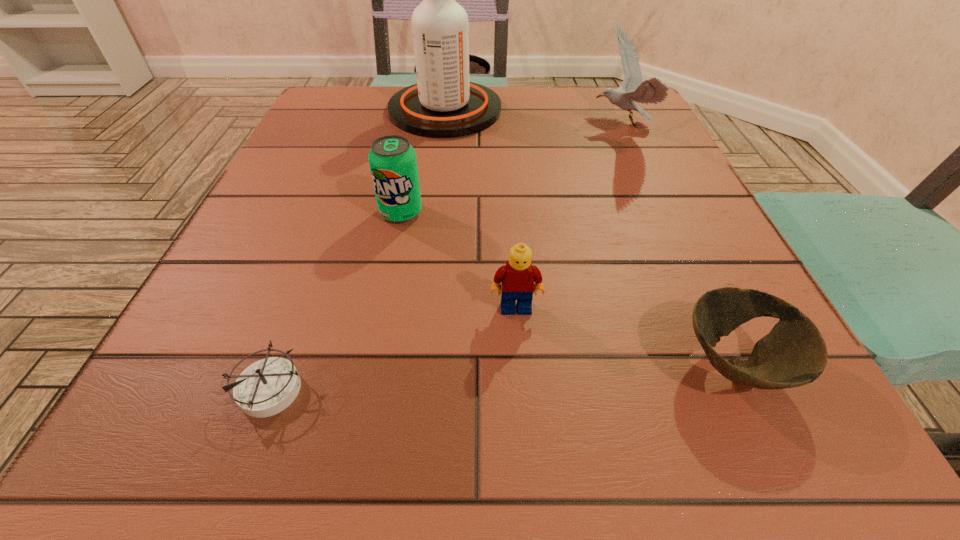
Find the location of a particular element. vacant area that satisfies the following two spatial constraints: 1. at the tip of the beak of the fifth shortest object; 2. on the front-facing side of the Lego is located at coordinates (705, 308).

I want to click on free space that satisfies the following two spatial constraints: 1. on the back side of the bowl; 2. at the tip of the beak of the second tallest object, so click(x=622, y=126).

Locate an element on the screen. free location that satisfies the following two spatial constraints: 1. at the tip of the beak of the fifth shortest object; 2. on the left side of the bowl is located at coordinates (731, 364).

Find the location of a particular element. free space in the image that satisfies the following two spatial constraints: 1. at the tip of the beak of the second tallest object; 2. on the front-facing side of the pop soda is located at coordinates (660, 212).

Find the location of a particular element. vacant space that satisfies the following two spatial constraints: 1. at the tip of the beak of the gull; 2. on the front-facing side of the pop soda is located at coordinates (660, 212).

You are a GUI agent. You are given a task and a screenshot of the screen. Output one action in this format:
    pyautogui.click(x=<x>, y=<y>)
    Task: Click on the vacant space that satisfies the following two spatial constraints: 1. at the tip of the beak of the fifth shortest object; 2. on the back side of the fifth tallest object
    This screenshot has height=540, width=960.
    Given the screenshot: What is the action you would take?
    [x=731, y=364]